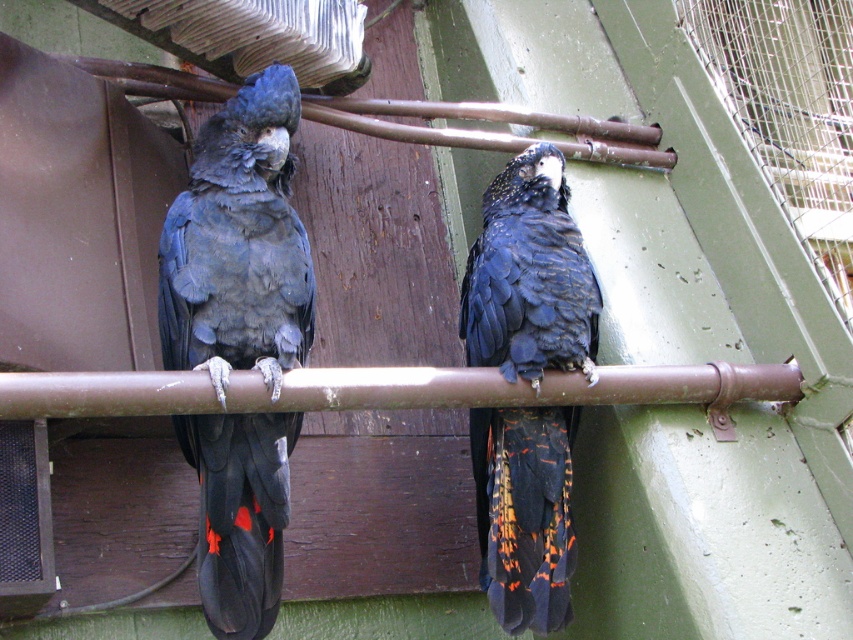
Who is taller, matte black parrot at left or black glossy feathers at center?

Standing taller between the two is matte black parrot at left.

Which is above, matte black parrot at left or black glossy feathers at center?

matte black parrot at left

The width and height of the screenshot is (853, 640). What are the coordinates of `matte black parrot at left` in the screenshot? It's located at (238, 244).